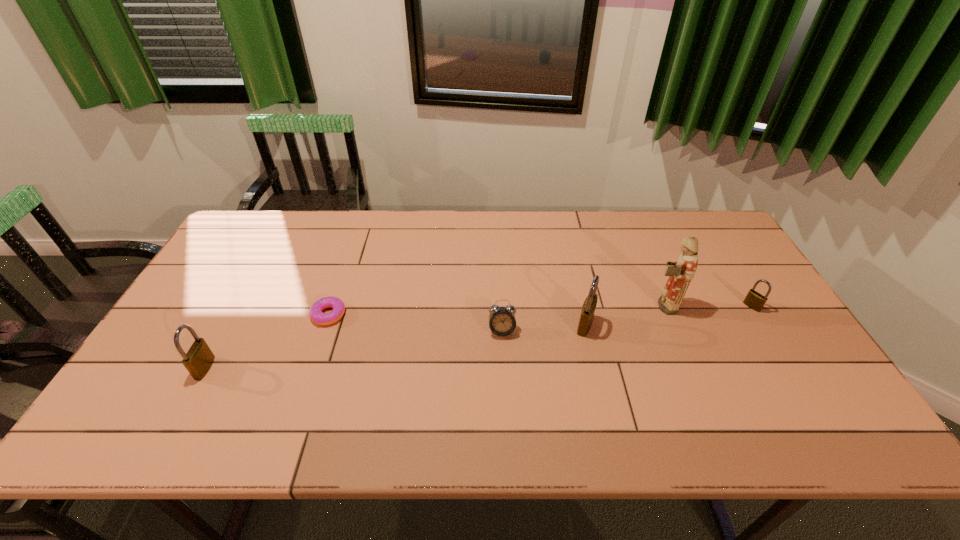
Identify the location of free point that satisfies the following two spatial constraints: 1. on the front-facing side of the fifth object from left to right; 2. on the front side of the nearest padlock. This screenshot has width=960, height=540. (688, 368).